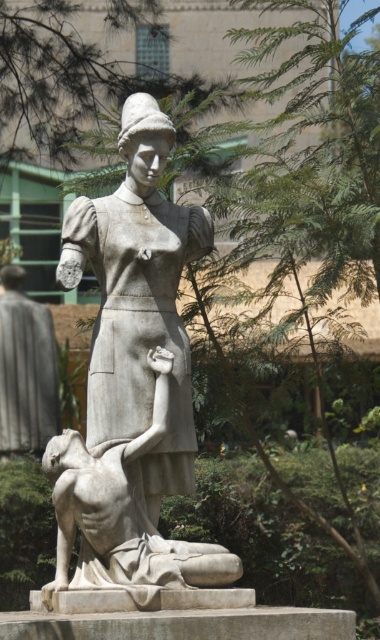
Question: Which point appears farthest from the camera in this image?

Choices:
 (A) (107, 305)
 (B) (212, 568)

Answer: (A)

Question: Which object appears closest to the camera in this image?

Choices:
 (A) white marble statue at center
 (B) matte gray statue at center

Answer: (A)

Question: From the image, what is the correct spatial relationship of matte gray statue at center in relation to white marble statue at center?

Choices:
 (A) left
 (B) right

Answer: (A)

Question: Is matte gray statue at center positioned before white marble statue at center?

Choices:
 (A) no
 (B) yes

Answer: (A)

Question: Which point is closer to the camera?

Choices:
 (A) white marble statue at center
 (B) matte gray statue at center

Answer: (A)

Question: From the image, what is the correct spatial relationship of matte gray statue at center in relation to white marble statue at center?

Choices:
 (A) right
 (B) left

Answer: (B)